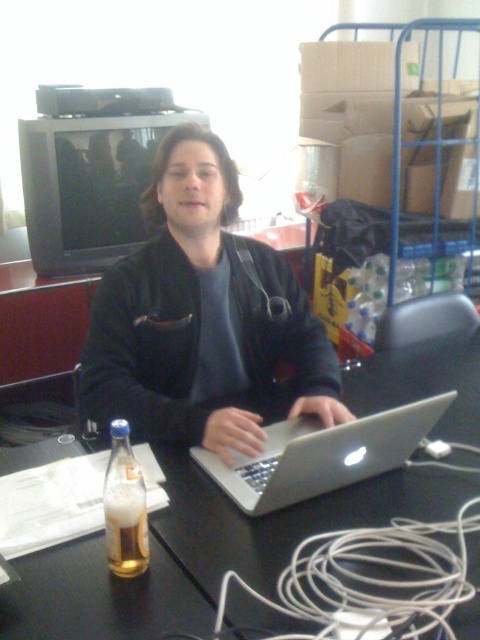
Who is more distant from viewer, (177, 252) or (355, 435)?

The point (177, 252) is behind.

Can you confirm if black matte jacket at center is positioned to the right of silver metallic laptop at center?

In fact, black matte jacket at center is to the left of silver metallic laptop at center.

The height and width of the screenshot is (640, 480). What do you see at coordinates (202, 317) in the screenshot?
I see `black matte jacket at center` at bounding box center [202, 317].

Find the location of a particular element. This screenshot has height=640, width=480. black matte jacket at center is located at coordinates (202, 317).

Does black matte jacket at center have a larger size compared to translucent glass bottle at lower left?

Correct, black matte jacket at center is larger in size than translucent glass bottle at lower left.

Does black matte jacket at center lie in front of translucent glass bottle at lower left?

No, it is not.

Who is more distant from viewer, [164,397] or [113,456]?

Positioned behind is point [164,397].

What are the coordinates of `black matte jacket at center` in the screenshot? It's located at (202, 317).

Does silver metallic laptop at center appear under translucent glass beer at lower left?

Incorrect, silver metallic laptop at center is not positioned below translucent glass beer at lower left.

Between point (382, 413) and point (109, 522), which one is positioned behind?

Point (382, 413)

This screenshot has height=640, width=480. Find the location of `silver metallic laptop at center`. silver metallic laptop at center is located at coordinates (322, 456).